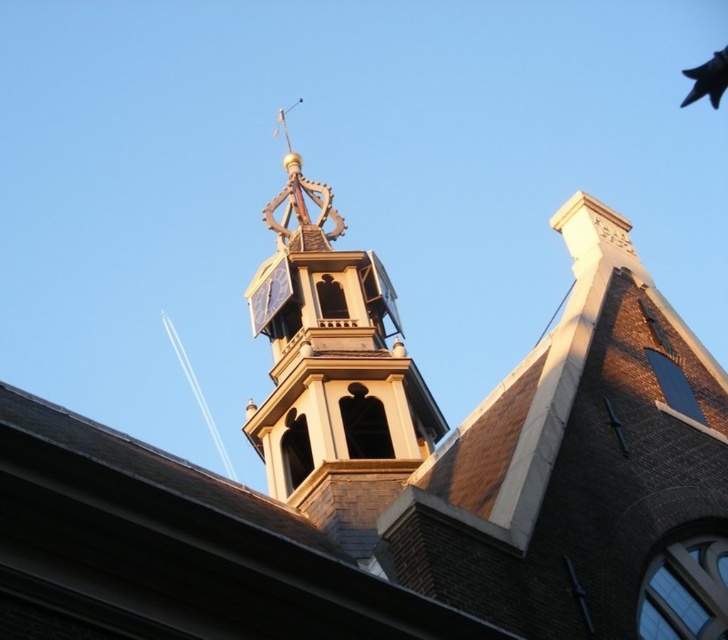
Identify the location of golden brick bell tower at upper center. The image size is (728, 640). (332, 371).

Does golden brick bell tower at upper center have a greater width compared to black feathered pigeon at upper right?

No.

Who is more forward, (320, 264) or (689, 96)?

Point (320, 264) is in front.

Identify the location of golden brick bell tower at upper center. (332, 371).